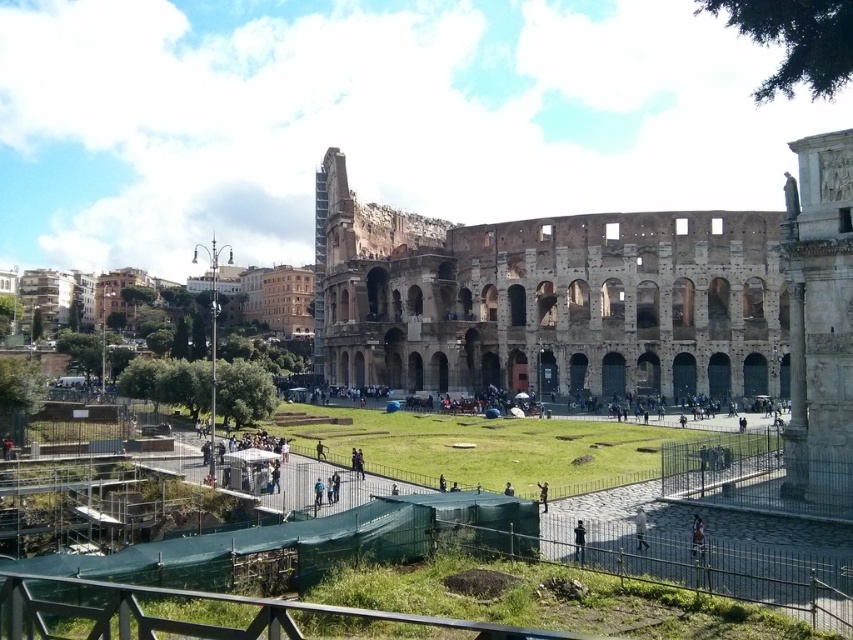
Between point (685, 280) and point (639, 534), which one is positioned in front?

Point (639, 534) is in front.

Does brown stone amphitheater at center have a smaller size compared to white matte jacket at center?

No, brown stone amphitheater at center is not smaller than white matte jacket at center.

Which is behind, point (502, 352) or point (639, 525)?

The point (502, 352) is more distant.

Find the location of a particular element. This screenshot has height=640, width=853. brown stone amphitheater at center is located at coordinates (549, 300).

Is brown stone amphitheater at center bigger than dark blue jeans at lower center?

Yes.

Which is above, brown stone amphitheater at center or dark blue jeans at lower center?

Positioned higher is brown stone amphitheater at center.

Which is in front, point (337, 273) or point (573, 525)?

Positioned in front is point (573, 525).

Locate an element on the screen. The image size is (853, 640). brown stone amphitheater at center is located at coordinates (549, 300).

Is white matte jacket at center closer to the viewer compared to dark blue jeans at lower center?

That is False.

Is white matte jacket at center below dark blue jeans at lower center?

Incorrect, white matte jacket at center is not positioned below dark blue jeans at lower center.

Who is more distant from viewer, (636, 541) or (577, 534)?

Point (577, 534)

Locate an element on the screen. This screenshot has width=853, height=640. white matte jacket at center is located at coordinates (640, 529).